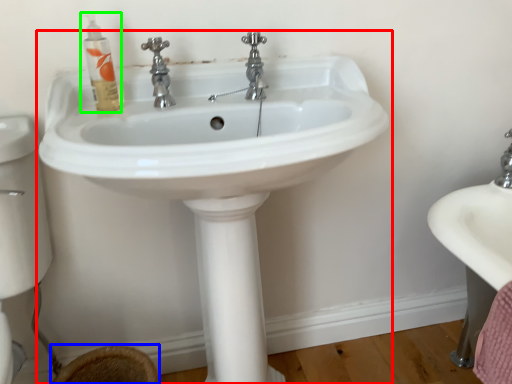
Question: Based on their relative distances, which object is farther from sink (highlighted by a red box)? Choose from toilet bowl (highlighted by a blue box) and mouthwash (highlighted by a green box).

Choices:
 (A) toilet bowl
 (B) mouthwash

Answer: (A)